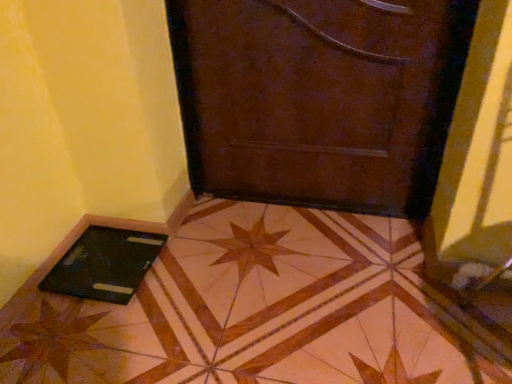
Image resolution: width=512 pixels, height=384 pixels. In order to click on empty space that is to the right of black matte tablet at lower left in this screenshot , I will do `click(174, 265)`.